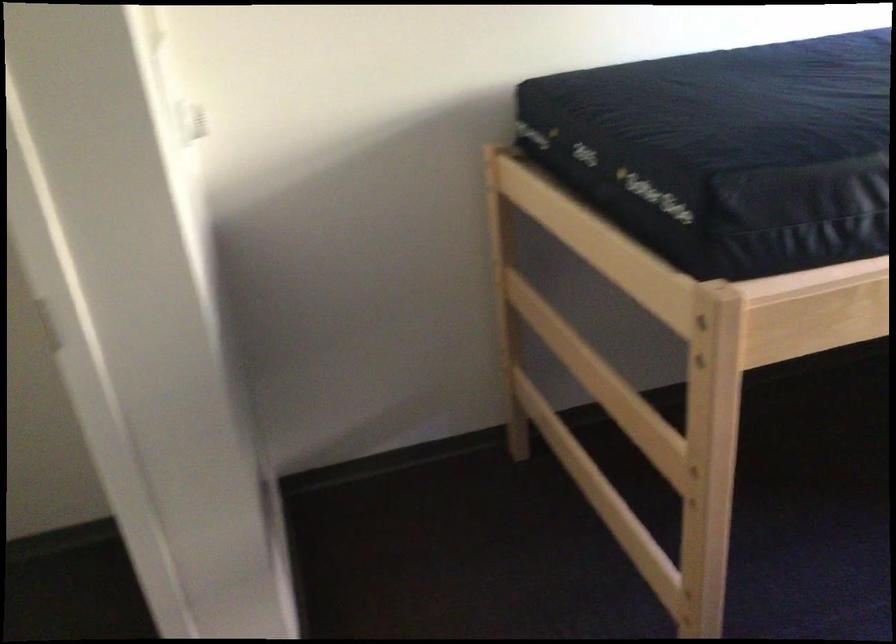
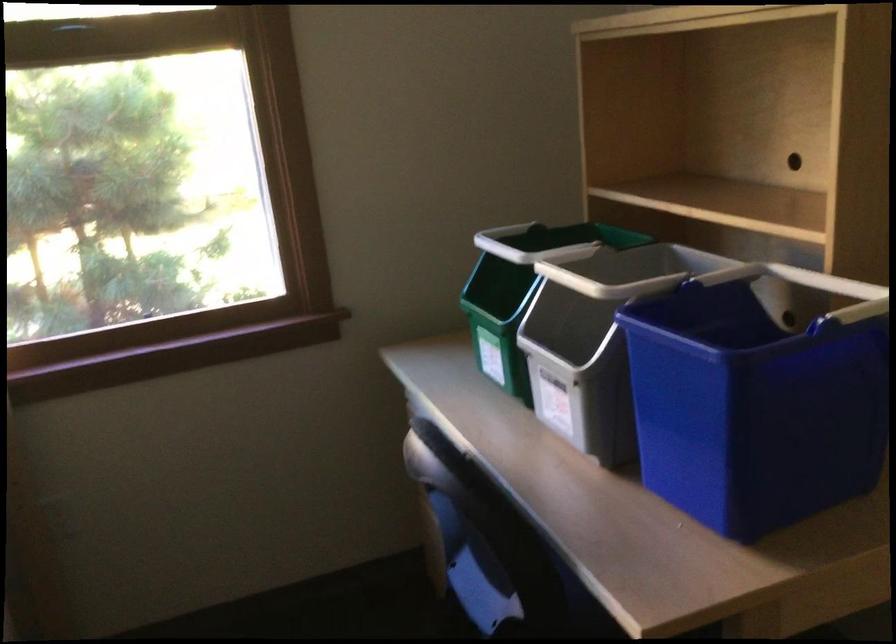
Question: The images are taken continuously from a first-person perspective. In which direction is your viewpoint rotating?

Choices:
 (A) Left
 (B) Right
 (C) Up
 (D) Down

Answer: (B)